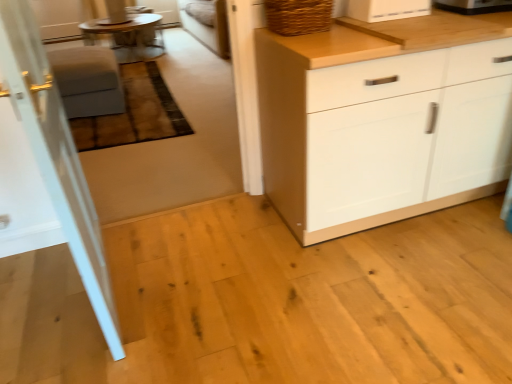
Image resolution: width=512 pixels, height=384 pixels. I want to click on free space in front of white glossy door at left, so click(x=85, y=340).